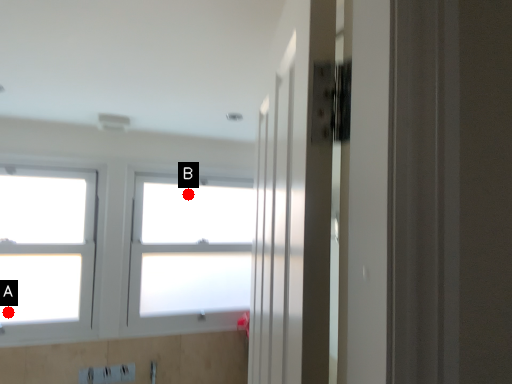
Question: Two points are circled on the image, labeled by A and B beside each circle. Which point appears closest to the camera in this image?

Choices:
 (A) A is closer
 (B) B is closer

Answer: (A)